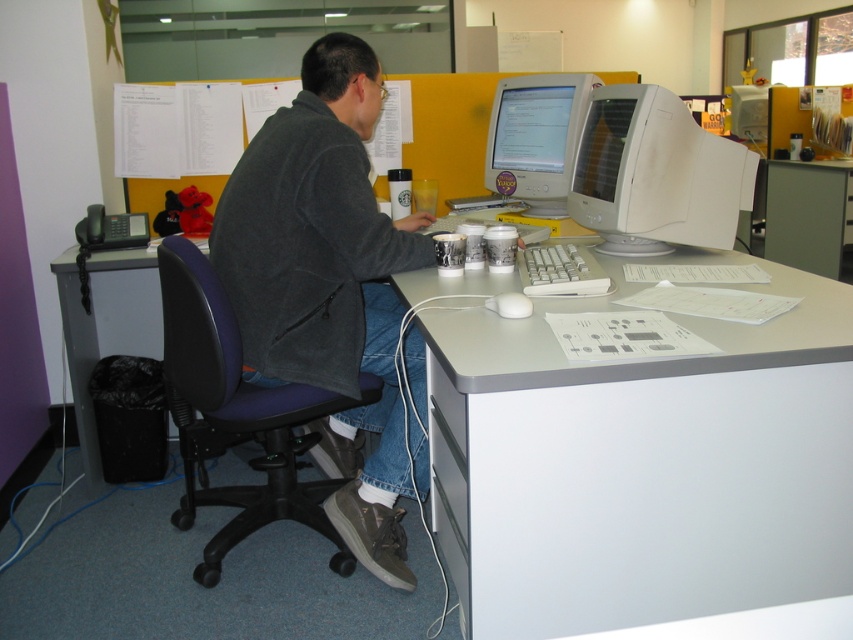
You are standing in front of the desk in the office scene. Where is the white glossy computer monitor at upper right located in relation to your position?

The white glossy computer monitor at upper right is located at point (654, 173) relative to your position.

You are standing in front of the desk in the office scene. There is a white glossy computer monitor at upper right. If you want to reach it without moving your feet, can you do it?

The white glossy computer monitor at upper right is 5.60 feet away from you. Since this distance is beyond typical arm reach, you cannot reach it without moving your feet.